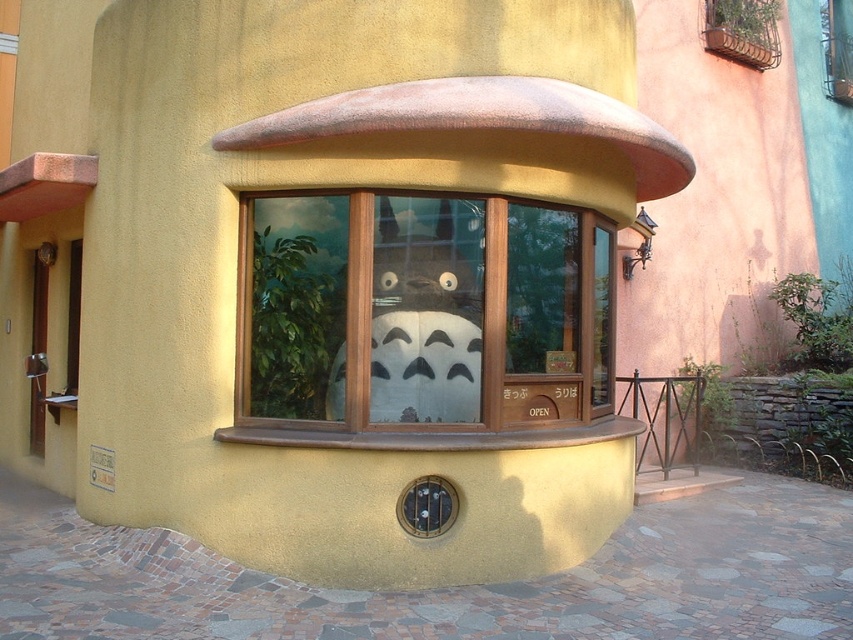
Question: Which of the following is the farthest from the observer?

Choices:
 (A) (397, 252)
 (B) (326, 259)

Answer: (B)

Question: From the image, what is the correct spatial relationship of wooden bay window at center in relation to white matte totoro at center?

Choices:
 (A) right
 (B) left

Answer: (A)

Question: Is wooden bay window at center below white matte totoro at center?

Choices:
 (A) yes
 (B) no

Answer: (B)

Question: Among these objects, which one is nearest to the camera?

Choices:
 (A) wooden bay window at center
 (B) white matte totoro at center

Answer: (A)

Question: Does wooden bay window at center appear under white matte totoro at center?

Choices:
 (A) yes
 (B) no

Answer: (B)